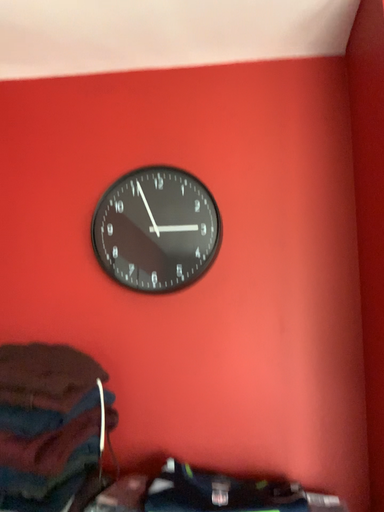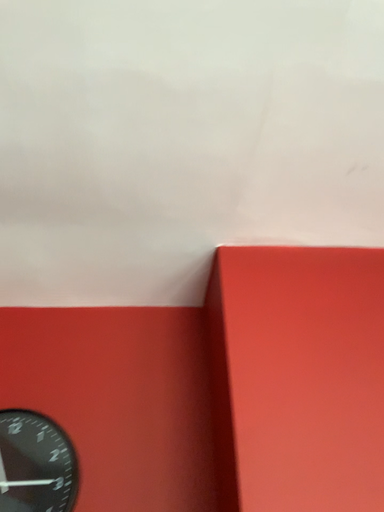
Question: How did the camera likely rotate when shooting the video?

Choices:
 (A) rotated right
 (B) rotated left

Answer: (A)